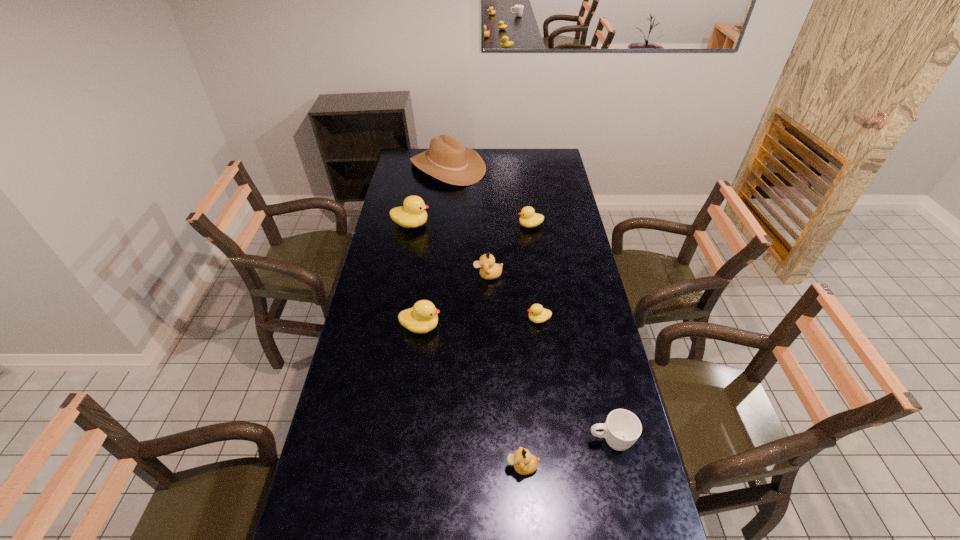
Where is `free space located on the beak of the second smallest yellow duckling`? free space located on the beak of the second smallest yellow duckling is located at coordinates (502, 225).

Where is `free spot located 0.390m with the handle on the side of the rightmost object`? The width and height of the screenshot is (960, 540). free spot located 0.390m with the handle on the side of the rightmost object is located at coordinates (454, 441).

Locate an element on the screen. free space located 0.400m with the handle on the side of the rightmost object is located at coordinates (451, 441).

Find the location of a particular element. free location located 0.080m with the handle on the side of the rightmost object is located at coordinates (560, 441).

Image resolution: width=960 pixels, height=540 pixels. In order to click on blank space located 0.230m on the face of the nearest duckling in this screenshot , I will do `click(424, 466)`.

Identify the location of vacant space situated 0.310m on the face of the nearest duckling. This screenshot has height=540, width=960. (396, 466).

Locate an element on the screen. The image size is (960, 540). free point located on the face of the nearest duckling is located at coordinates (374, 466).

You are a GUI agent. You are given a task and a screenshot of the screen. Output one action in this format:
    pyautogui.click(x=<x>, y=<y>)
    Task: Click on the vacant space located on the beak of the shortest duckling
    Image resolution: width=960 pixels, height=540 pixels.
    Given the screenshot: What is the action you would take?
    pyautogui.click(x=426, y=319)

Find the location of `free space located on the beak of the shortest duckling`. free space located on the beak of the shortest duckling is located at coordinates (432, 319).

This screenshot has width=960, height=540. Identify the location of free spot located on the beak of the shortest duckling. (437, 319).